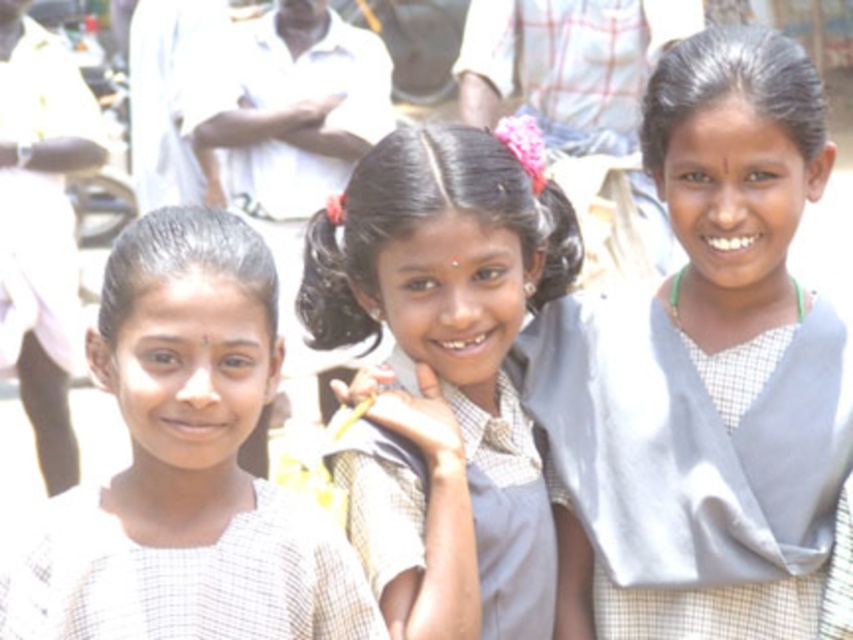
You are a photographer trying to capture a group shot of the light gray fabric sari at center and the white checkered shirt at left. Given that your camera has a maximum focus range of 8 meters, will you be able to focus on both subjects simultaneously?

The distance between the light gray fabric sari at center and the white checkered shirt at left is 9.28 meters, which exceeds the camera maximum focus range of 8 meters. Therefore, you cannot focus on both subjects simultaneously.

You are a photographer trying to adjust the lighting for a group photo. You notice two items in the scene that might cast shadows. The matte gray uniform at center and the white checkered shirt at left. Which item is narrower and might cast a smaller shadow?

The matte gray uniform at center has a lesser width compared to the white checkered shirt at left, so it would cast a smaller shadow.

You are a photographer trying to capture a group photo of the three girls. You want to ensure that the light gray fabric sari at center and the white checkered shirt at left are both visible in the frame. Based on their positions, which girl should you focus on to include both items in the photo?

The light gray fabric sari at center is to the right of the white checkered shirt at left. To include both items in the frame, focus on the middle girl, as she is positioned between the two items.